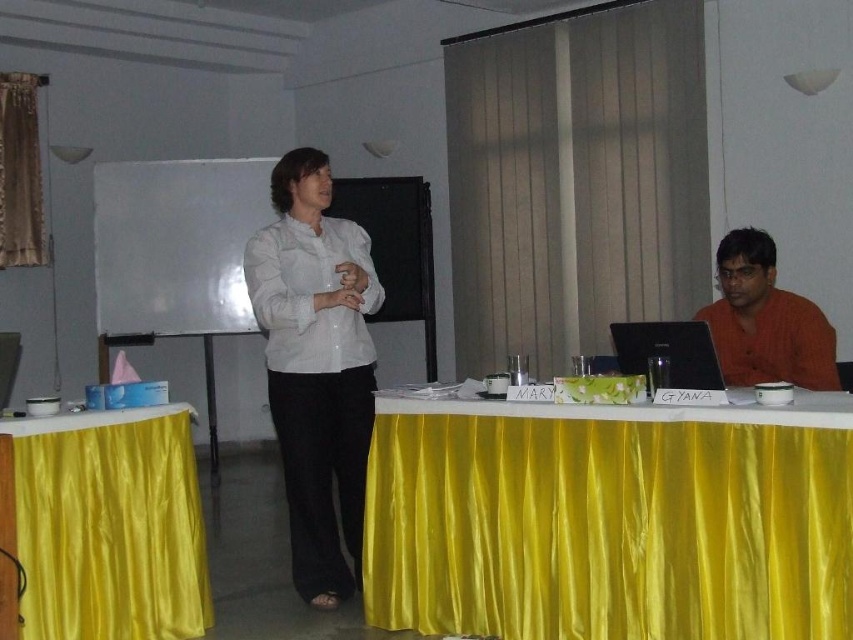
Is point (18, 161) closer to camera compared to point (637, 371)?

No, (18, 161) is behind (637, 371).

Is gold satin curtain at upper left taller than black glossy laptop at center?

Correct, gold satin curtain at upper left is much taller as black glossy laptop at center.

Between point (24, 221) and point (706, 324), which one is positioned behind?

Point (24, 221)

I want to click on gold satin curtain at upper left, so click(x=19, y=172).

Measure the distance from brown fabric curtain at upper center to brown cotton shirt at right.

brown fabric curtain at upper center is 7.85 feet away from brown cotton shirt at right.

Between point (694, 243) and point (751, 276), which one is positioned in front?

Point (751, 276) is more forward.

The width and height of the screenshot is (853, 640). Find the location of `brown fabric curtain at upper center`. brown fabric curtain at upper center is located at coordinates (575, 180).

Is yellow satin tablecloth at lower center to the right of white glossy shirt at center from the viewer's perspective?

Correct, you'll find yellow satin tablecloth at lower center to the right of white glossy shirt at center.

Who is more distant from viewer, (840, 413) or (286, 266)?

Positioned behind is point (286, 266).

Find the location of a particular element. Image resolution: width=853 pixels, height=640 pixels. yellow satin tablecloth at lower center is located at coordinates (610, 518).